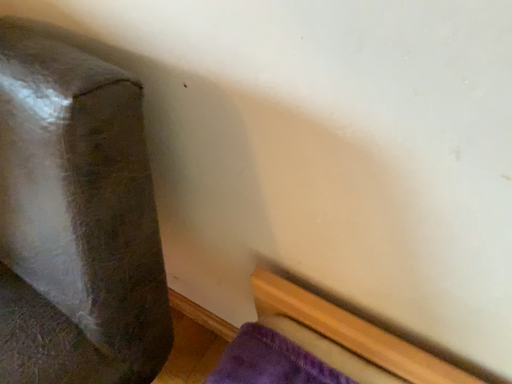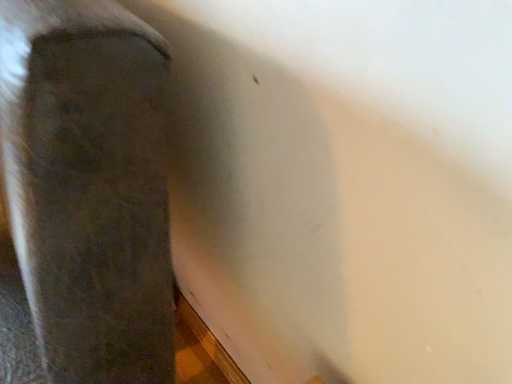
Question: How did the camera likely rotate when shooting the video?

Choices:
 (A) rotated downward
 (B) rotated upward

Answer: (B)